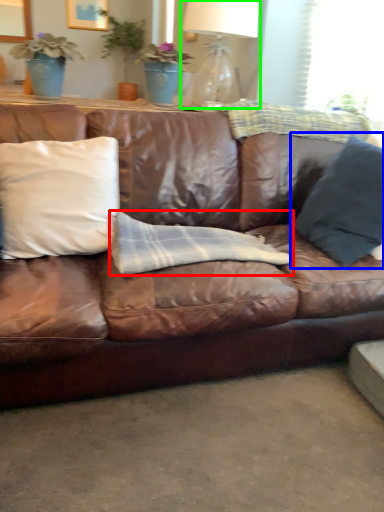
Question: Estimate the real-world distances between objects in this image. Which object is closer to material (highlighted by a red box), pillow (highlighted by a blue box) or table lamp (highlighted by a green box)?

Choices:
 (A) pillow
 (B) table lamp

Answer: (A)